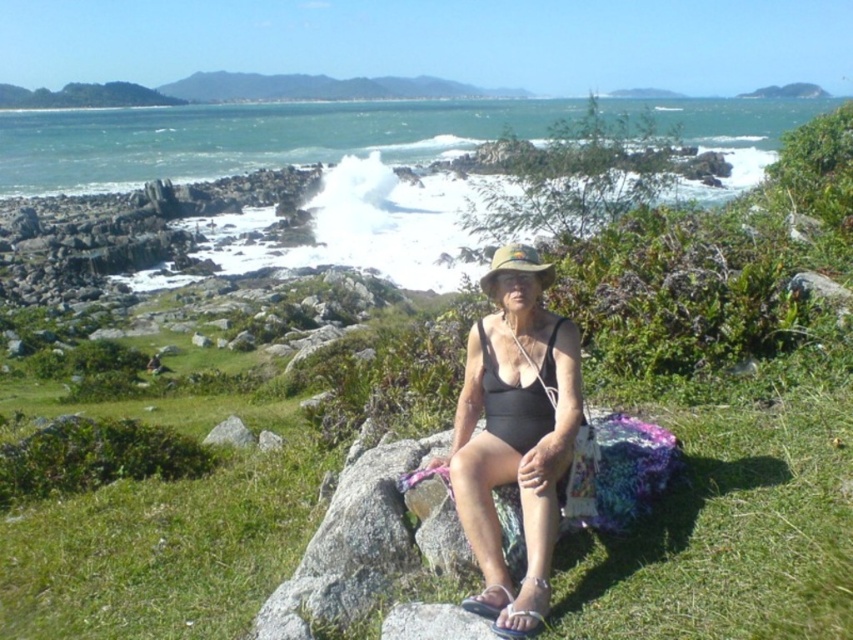
Question: Is black matte bikini top at center above green fabric hat at center?

Choices:
 (A) yes
 (B) no

Answer: (B)

Question: Which point is farther to the camera?

Choices:
 (A) (212, 432)
 (B) (500, 278)
 (C) (527, 244)

Answer: (A)

Question: Can you confirm if matte black swimsuit at center is positioned above green fabric hat at center?

Choices:
 (A) yes
 (B) no

Answer: (B)

Question: Which point is closer to the camera taking this photo?

Choices:
 (A) [532, 468]
 (B) [207, 433]

Answer: (A)

Question: Which point is closer to the camera?

Choices:
 (A) gray rock at center
 (B) matte black swimsuit at center

Answer: (B)

Question: Is matte black swimsuit at center positioned before black matte bikini top at center?

Choices:
 (A) yes
 (B) no

Answer: (A)